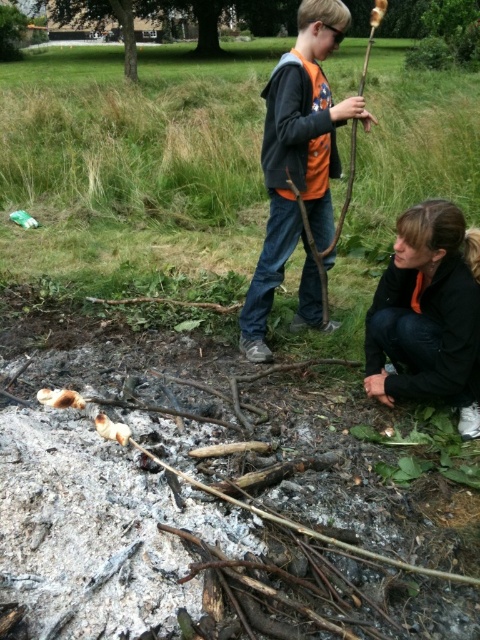
You are planning to place a small table between the orange fabric shirt at center and the black soft jacket at lower right. What is the minimum length the table should be to fit between them?

The orange fabric shirt at center and black soft jacket at lower right are 3.80 feet apart, so the table should be at least 3.80 feet long to fit between them.

In the scene where two people are roasting marshmallows over a fire, you notice an orange fabric shirt at center and a black soft jacket at lower right. Which of these items is positioned more to the right side of the image?

The orange fabric shirt at center is positioned to the right of the black soft jacket at lower right, so the orange fabric shirt at center is more to the right side of the image.